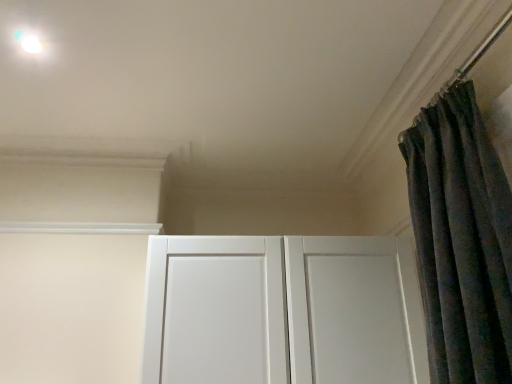
In order to face dark green textured curtain at right, should I rotate leftwards or rightwards?

You should look right and rotate roughly 23.783 degrees.

Describe the element at coordinates (461, 240) in the screenshot. I see `dark green textured curtain at right` at that location.

Image resolution: width=512 pixels, height=384 pixels. I want to click on dark green textured curtain at right, so click(461, 240).

What are the coordinates of `dark green textured curtain at right` in the screenshot? It's located at (461, 240).